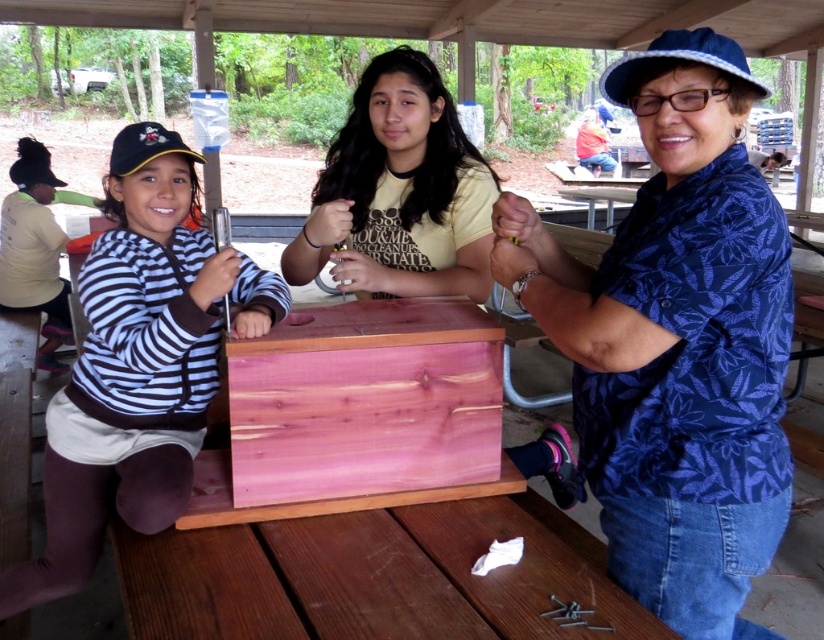
Question: Can you confirm if blue floral shirt at center is smaller than cedar wood crate at center?

Choices:
 (A) yes
 (B) no

Answer: (B)

Question: Is smooth wood picnic table at center to the left of yellow t-shirt at center from the viewer's perspective?

Choices:
 (A) yes
 (B) no

Answer: (B)

Question: Which point is closer to the camera?

Choices:
 (A) (237, 401)
 (B) (607, 419)

Answer: (B)

Question: Considering the relative positions of smooth wood picnic table at center and striped jersey at center in the image provided, where is smooth wood picnic table at center located with respect to striped jersey at center?

Choices:
 (A) right
 (B) left

Answer: (A)

Question: Which object appears farthest from the camera in this image?

Choices:
 (A) yellow t-shirt at center
 (B) smooth wood picnic table at center

Answer: (A)

Question: Estimate the real-world distances between objects in this image. Which object is closer to the smooth wood picnic table at center?

Choices:
 (A) blue floral shirt at center
 (B) striped jersey at center

Answer: (B)